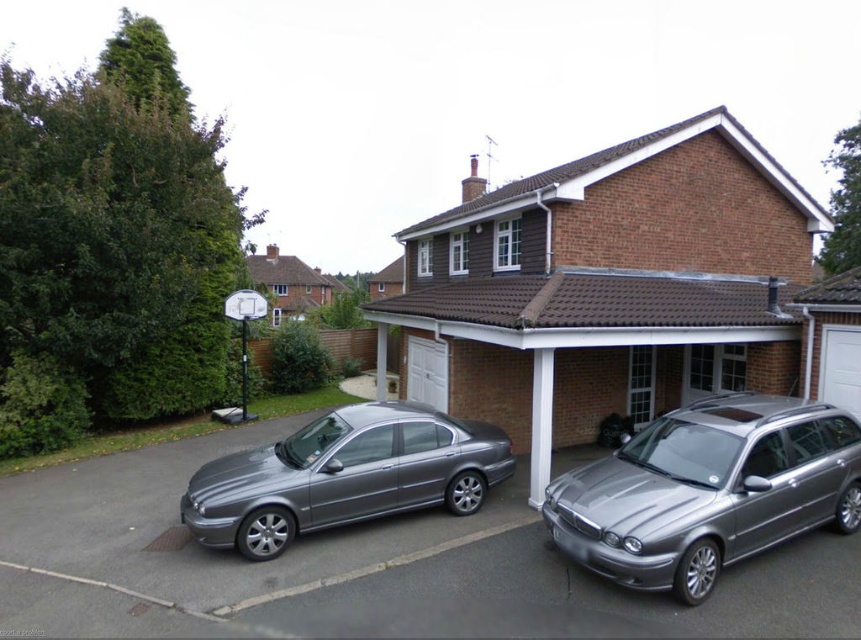
You are a delivery person trying to park your van between the two cars in front of the house. The van is 2 meters wide. Can you fit your van between the satin silver car at center and the satin silver sedan at center?

The satin silver car at center is to the left of the satin silver sedan at center. However, the exact distance between them is not provided, so it is impossible to determine if the van can fit.

You are a delivery person arriving at this house to drop off a package. You need to park your vehicle in front of the house but want to ensure there is enough space between the satin silver sedan at center and the brown brick garage at center for your van, which is 2 meters wide. Can you determine if there is sufficient space?

The satin silver sedan at center is behind the brown brick garage at center, so there is no space between them for the van to park. You should look for another parking spot.